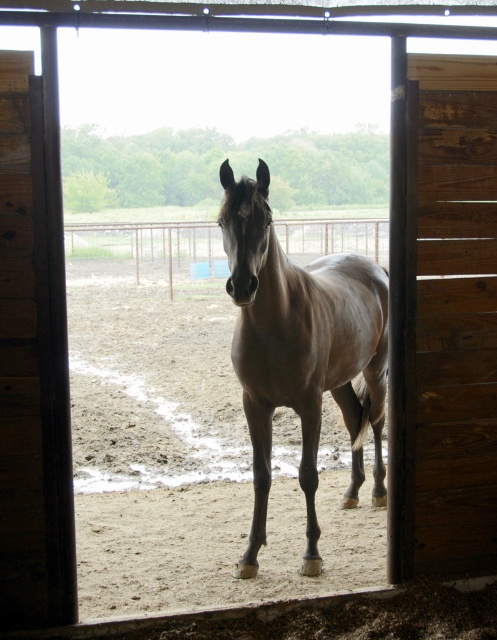
Is point (431, 429) less distant than point (287, 282)?

Yes, point (431, 429) is in front of point (287, 282).

Between brown wooden door at right and brown glossy horse at center, which one appears on the right side from the viewer's perspective?

brown wooden door at right

Is point (454, 80) positioned before point (373, 500)?

That is True.

This screenshot has height=640, width=497. I want to click on brown wooden door at right, so click(x=444, y=321).